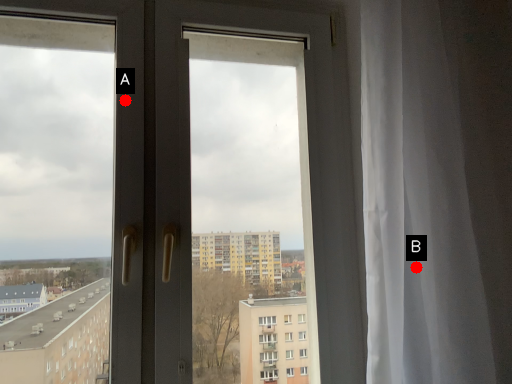
Question: Two points are circled on the image, labeled by A and B beside each circle. Which point is farther from the camera taking this photo?

Choices:
 (A) A is further
 (B) B is further

Answer: (A)